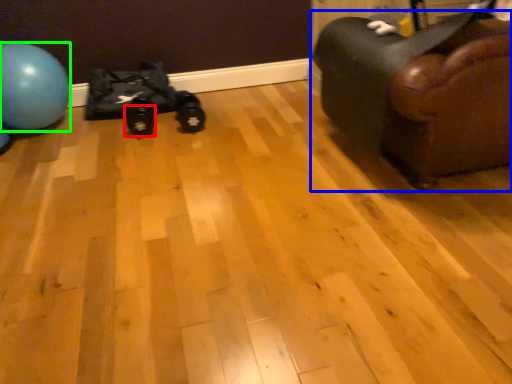
Question: Which object is the closest to the footwear (highlighted by a red box)? Choose among these: furniture (highlighted by a blue box) or ball (highlighted by a green box).

Choices:
 (A) furniture
 (B) ball

Answer: (B)